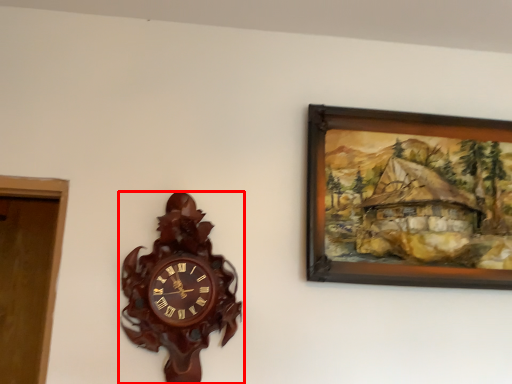
Question: Observing the image, what is the correct spatial positioning of wall clock (annotated by the red box) in reference to picture frame?

Choices:
 (A) left
 (B) right

Answer: (A)